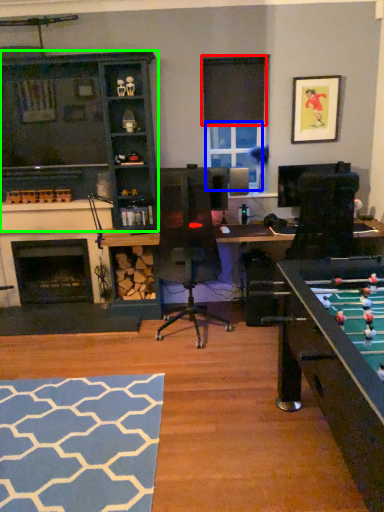
Question: Which object is positioned farthest from curtain (highlighted by a red box)? Select from window screen (highlighted by a blue box) and cabinetry (highlighted by a green box).

Choices:
 (A) window screen
 (B) cabinetry

Answer: (B)